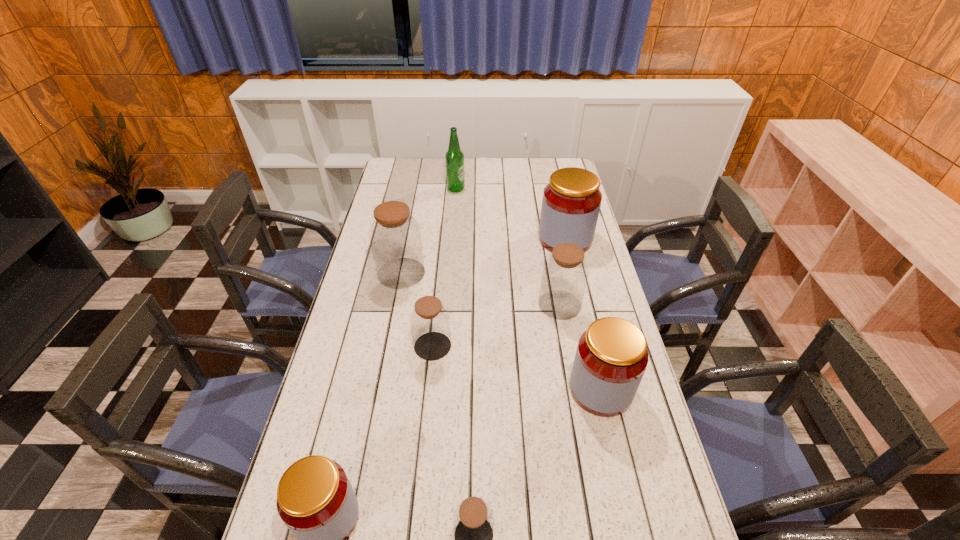
Find the location of a particular element. The image size is (960, 540). green beer bottle is located at coordinates (454, 157).

This screenshot has height=540, width=960. I want to click on the farthest object, so click(454, 157).

At what (x,y) coordinates should I click in order to perform the action: click on the second farthest object. Please return your answer as a coordinate pair (x, y). This screenshot has width=960, height=540. Looking at the image, I should click on (571, 201).

Find the location of `the farthest jar`. the farthest jar is located at coordinates (571, 201).

Find the location of `the biggest brown jar`. the biggest brown jar is located at coordinates (395, 236).

Where is `the second biggest brown jar`? This screenshot has height=540, width=960. the second biggest brown jar is located at coordinates click(565, 273).

Locate an element on the screen. This screenshot has width=960, height=540. the third nearest jar is located at coordinates (611, 358).

Locate an element on the screen. This screenshot has width=960, height=540. the second farthest red jar is located at coordinates (611, 358).

At what (x,y) coordinates should I click in order to perform the action: click on the fourth nearest object. Please return your answer as a coordinate pair (x, y). The width and height of the screenshot is (960, 540). Looking at the image, I should click on (430, 324).

You are a GUI agent. You are given a task and a screenshot of the screen. Output one action in this format:
    pyautogui.click(x=<x>, y=<y>)
    Task: Click on the third farthest brown jar
    
    Given the screenshot: What is the action you would take?
    pyautogui.click(x=430, y=324)